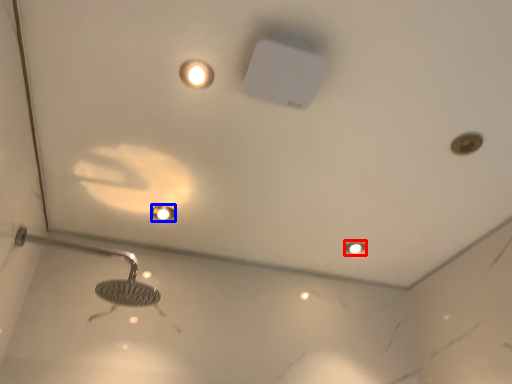
Question: Which of the following is the farthest to the observer, light fixture (highlighted by a red box) or droplight (highlighted by a blue box)?

Choices:
 (A) light fixture
 (B) droplight

Answer: (A)